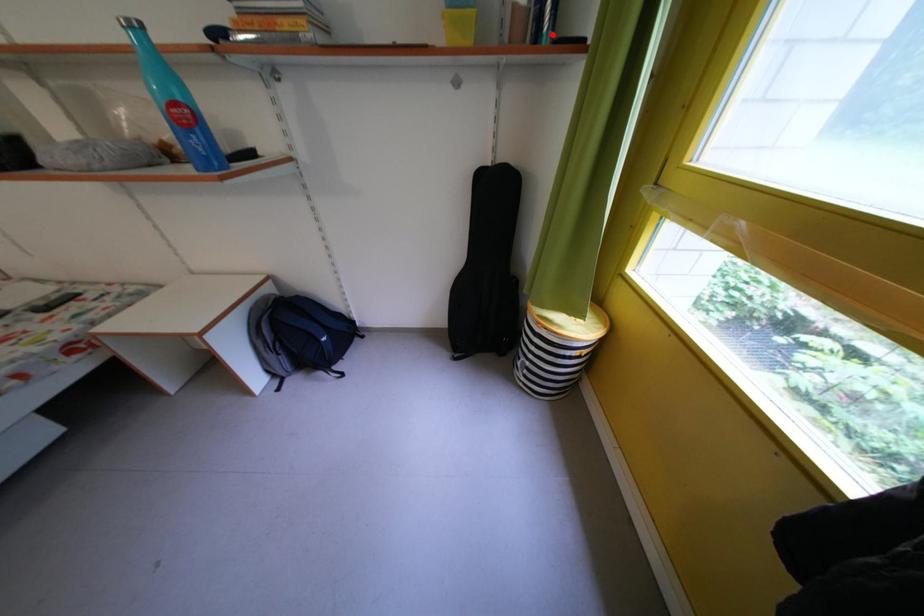
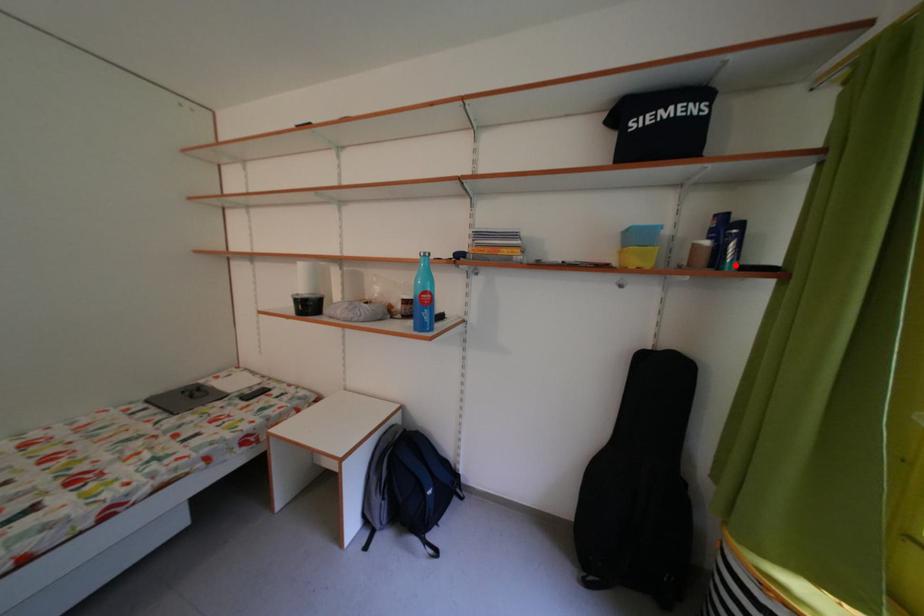
I am providing you with two images of the same scene from different viewpoints. A red point is marked on the first image and another point is marked on the second image. Is the marked point in image1 the same physical position as the marked point in image2?

Yes